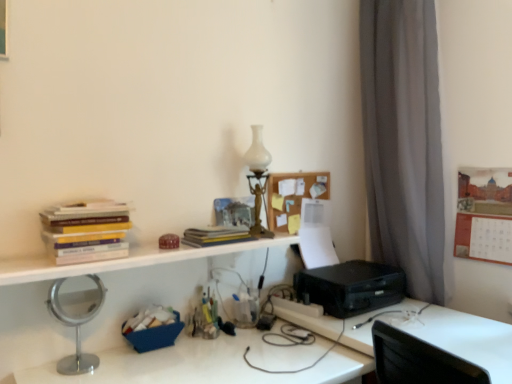
Identify the location of free space that is to the left of matte brown box at center, which is the third stationery in bottom-to-top order. (143, 249).